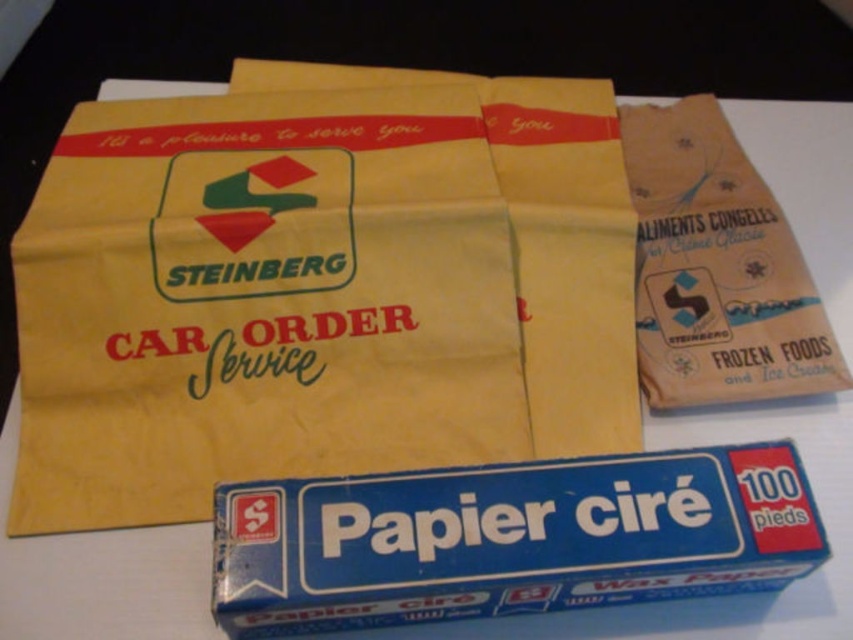
In the scene shown: You are organizing a vintage packaging display and need to place the yellow paper bag at upper center and the brown paper bag at upper right. Which bag requires more shelf space due to its size?

The yellow paper bag at upper center requires more shelf space because it has a larger size compared to the brown paper bag at upper right.

You are holding a camera and want to take a photo of the vintage packaging materials. The camera is currently focused on the point at coordinates point (335, 273). If you want to capture the entire scene in focus, should you adjust the focus closer or farther from the camera?

The point (335, 273) is 32.09 inches away from the camera. To capture the entire scene in focus, you should adjust the focus farther from the camera to ensure all elements are sharp.